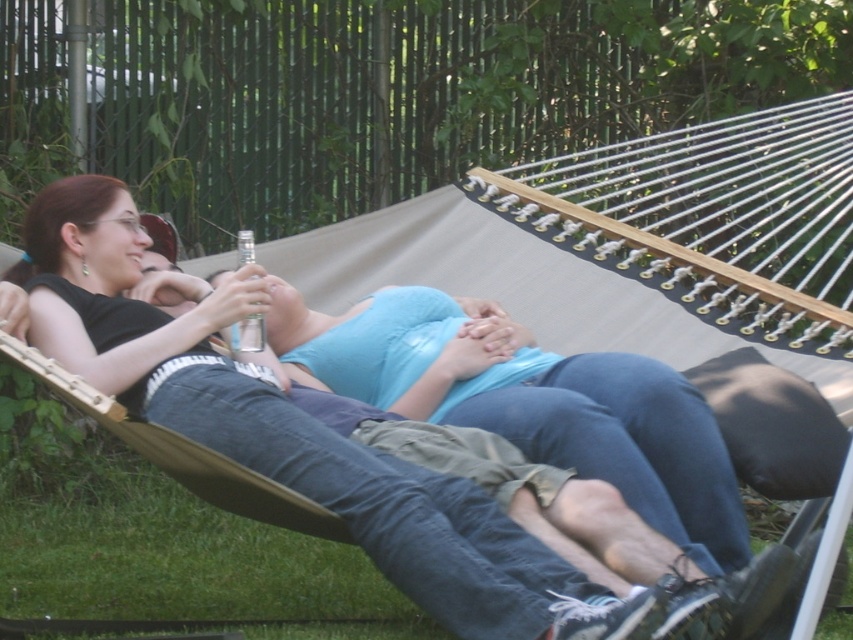
Is point (695, 412) closer to camera compared to point (463, 602)?

No, (695, 412) is further to viewer.

Which of these two, blue denim jeans at center or denim jeans at center, stands shorter?

blue denim jeans at center is shorter.

Describe the element at coordinates (529, 403) in the screenshot. The image size is (853, 640). I see `blue denim jeans at center` at that location.

Find the location of a particular element. This screenshot has height=640, width=853. blue denim jeans at center is located at coordinates (529, 403).